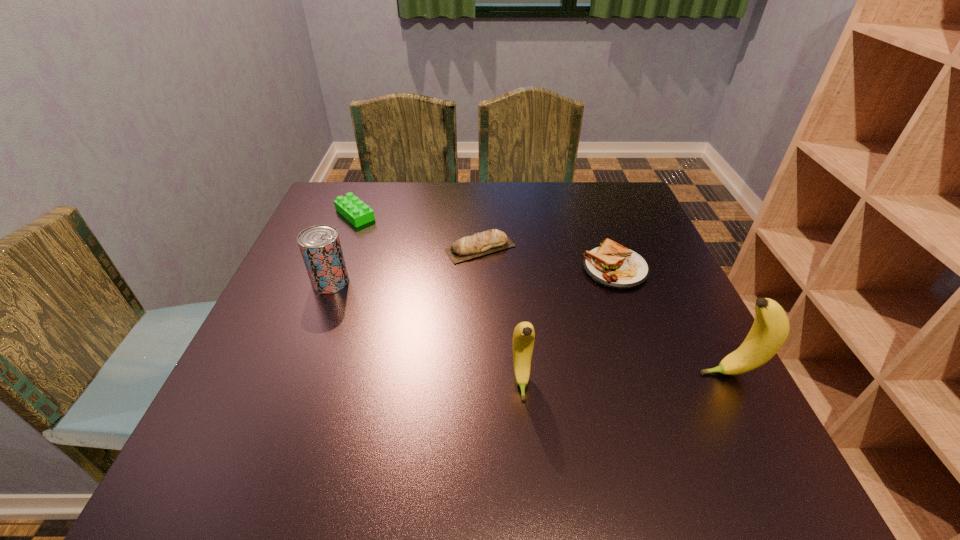
Locate an element on the screen. free space located 0.260m on the right of the farthest object is located at coordinates (471, 215).

The width and height of the screenshot is (960, 540). Identify the location of vacant space situated 0.110m on the left of the pita bread. (399, 248).

I want to click on vacant region located on the front of the sandwich, so click(x=646, y=354).

Where is `free space located on the back of the third tallest object`? This screenshot has height=540, width=960. free space located on the back of the third tallest object is located at coordinates (344, 247).

Find the location of a particular element. This screenshot has height=540, width=960. object situated at the far edge is located at coordinates (350, 207).

The image size is (960, 540). In order to click on object located at the near edge in this screenshot , I will do `click(524, 335)`.

Locate an element on the screen. Image resolution: width=960 pixels, height=540 pixels. Lego located in the left edge section of the desktop is located at coordinates (350, 207).

This screenshot has height=540, width=960. I want to click on beer can present at the left edge, so click(320, 246).

Identify the location of banana present at the right edge. The width and height of the screenshot is (960, 540). (770, 329).

Locate an element on the screen. This screenshot has height=540, width=960. sandwich situated at the right edge is located at coordinates (613, 265).